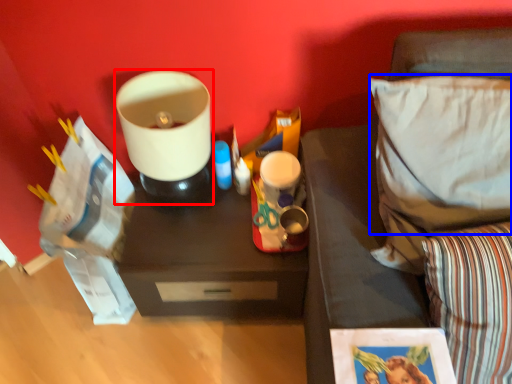
Question: Which object appears farthest to the camera in this image, appliance (highlighted by a red box) or pillow (highlighted by a blue box)?

Choices:
 (A) appliance
 (B) pillow

Answer: (A)